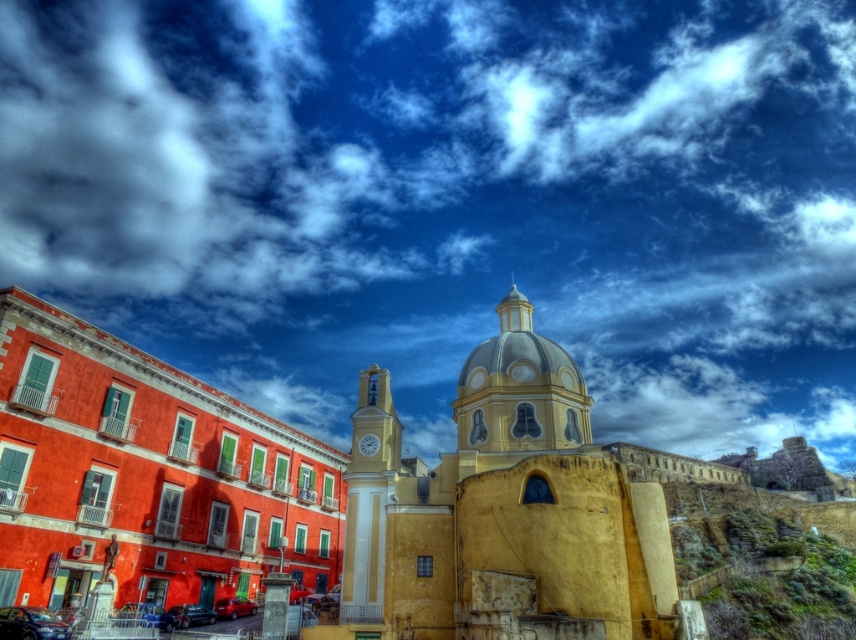
Measure the distance from white fluffy cloud at upper center to yellow stucco church at center.

white fluffy cloud at upper center is 189.71 meters from yellow stucco church at center.

Is point (324, 49) farther from camera compared to point (496, 336)?

That is True.

Who is more forward, (568, 300) or (354, 428)?

Positioned in front is point (354, 428).

Find the location of a particular element. white fluffy cloud at upper center is located at coordinates (450, 198).

Is matte orange building at center-left wider than yellow stucco church at center?

Indeed, matte orange building at center-left has a greater width compared to yellow stucco church at center.

Between matte orange building at center-left and yellow stucco church at center, which one is positioned higher?

yellow stucco church at center is higher up.

Which is behind, point (250, 512) or point (613, 525)?

Point (250, 512)

Find the location of a particular element. This screenshot has width=856, height=640. matte orange building at center-left is located at coordinates (327, 486).

Is point (603, 497) less distant than point (305, 566)?

Yes.

Image resolution: width=856 pixels, height=640 pixels. I want to click on yellow stucco church at center, so click(x=503, y=513).